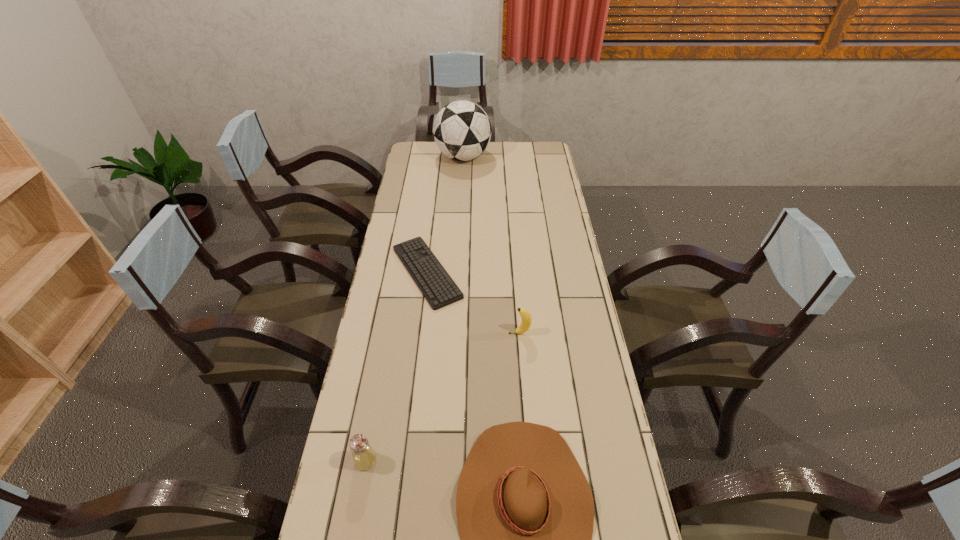
Where is `blank area in the image that satisfies the following two spatial constraints: 1. on the back side of the saltshaker; 2. on the right side of the shortest object`? The image size is (960, 540). blank area in the image that satisfies the following two spatial constraints: 1. on the back side of the saltshaker; 2. on the right side of the shortest object is located at coordinates (400, 272).